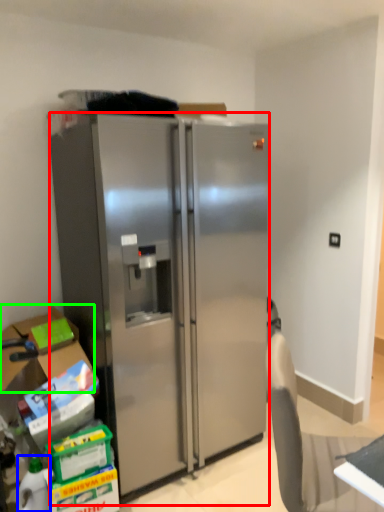
Question: Based on their relative distances, which object is nearer to refrigerator (highlighted by a red box)? Choose from bottle (highlighted by a blue box) and box (highlighted by a green box).

Choices:
 (A) bottle
 (B) box

Answer: (B)